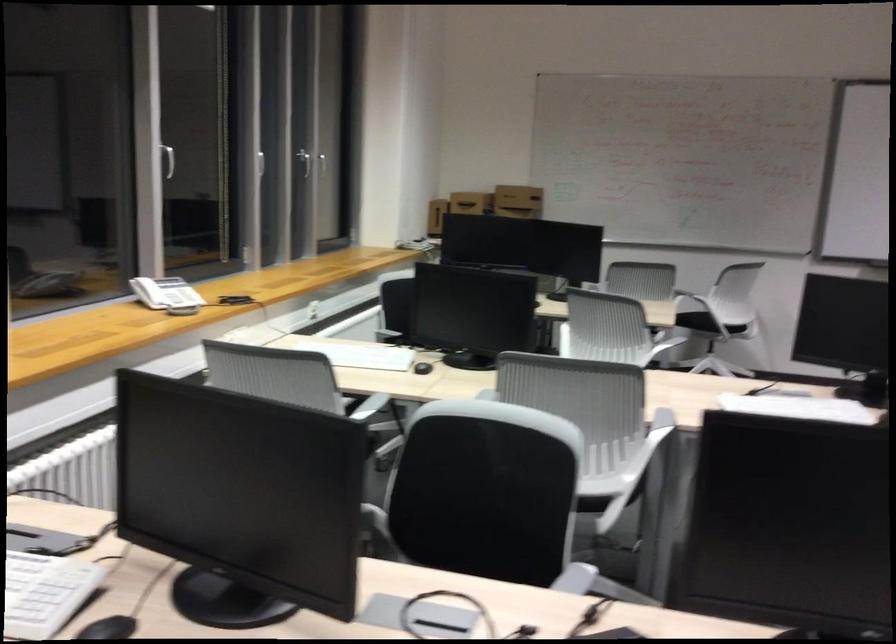
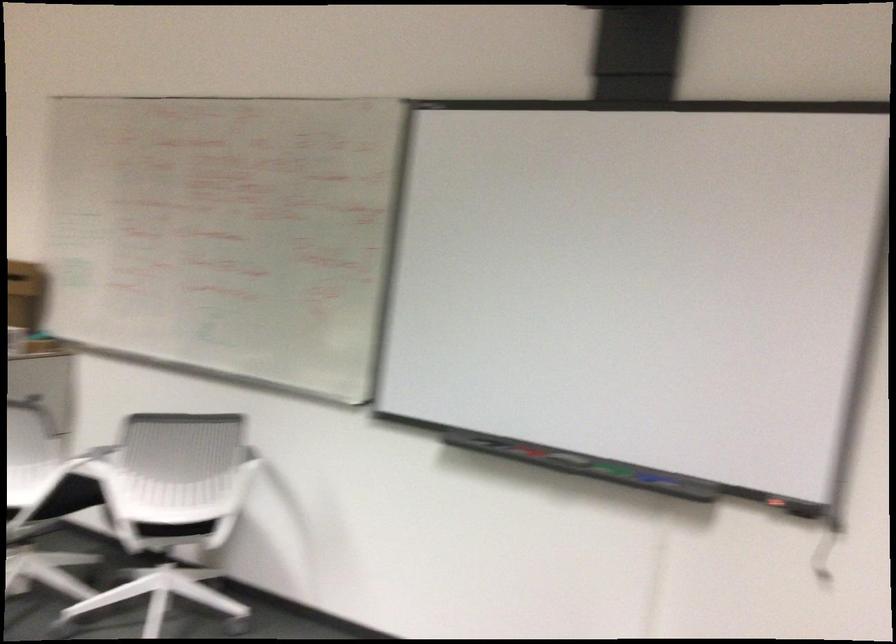
The point at (762, 312) is marked in the first image. Where is the corresponding point in the second image?

(175, 529)